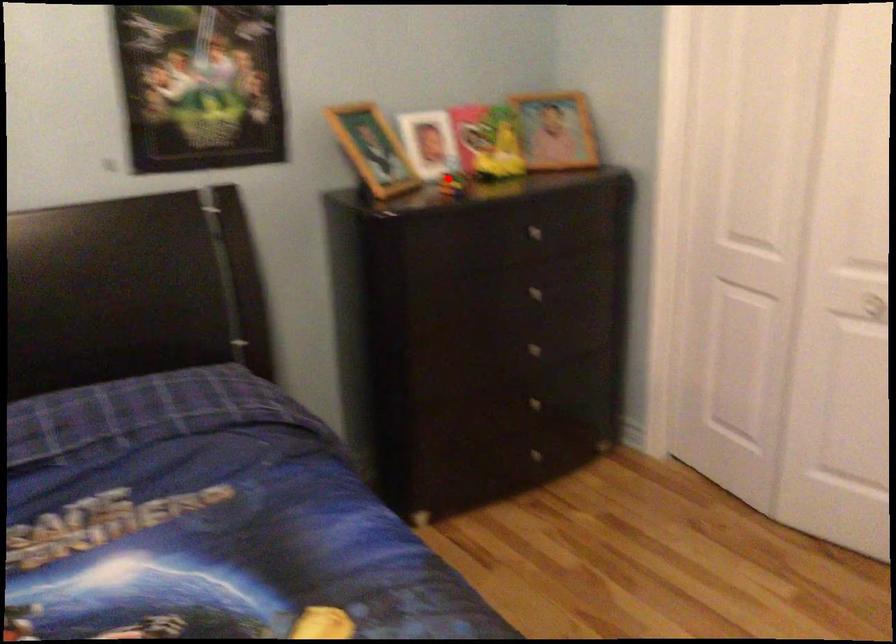
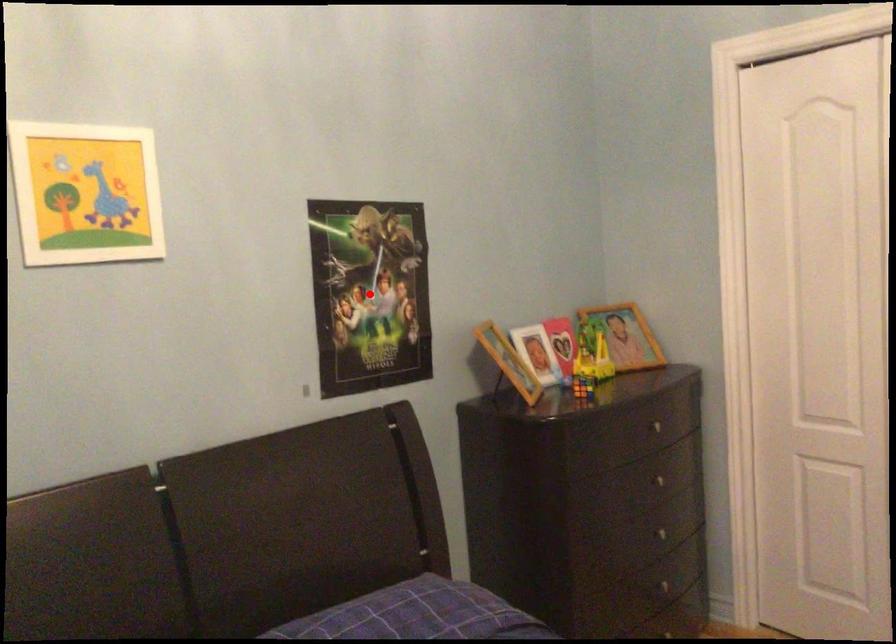
I am providing you with two images of the same scene from different viewpoints. A red point is marked on the first image and another point is marked on the second image. Do the highlighted points in image1 and image2 indicate the same real-world spot?

No